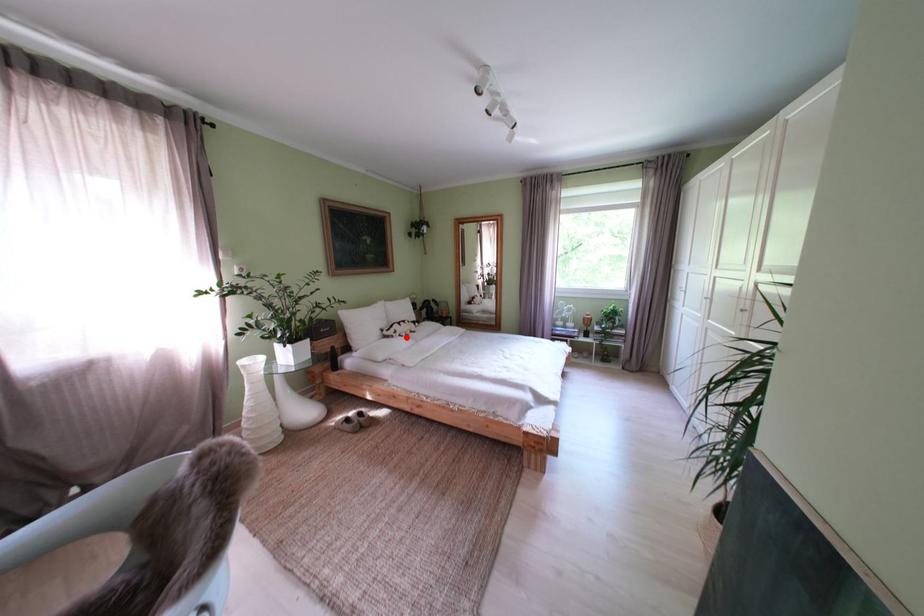
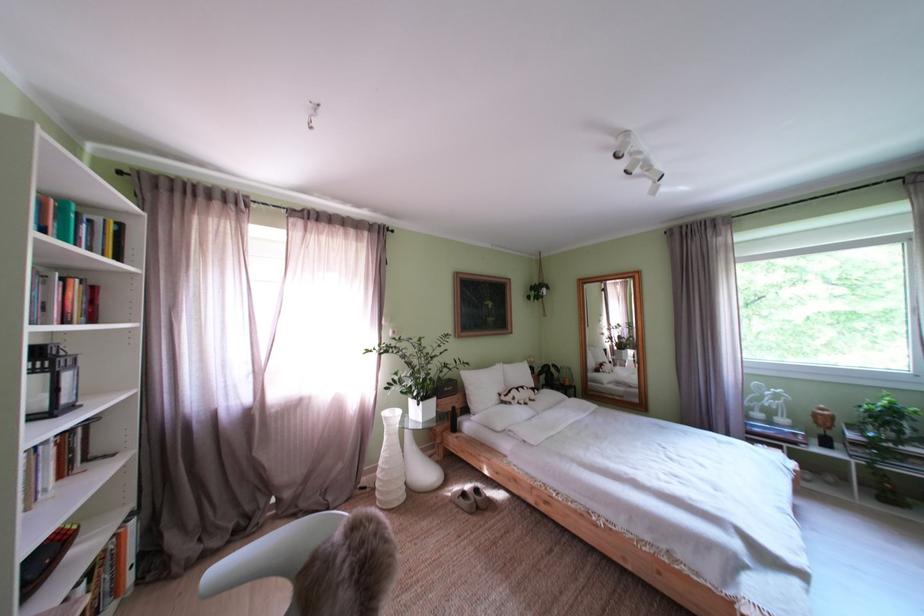
Question: I am providing you with two images of the same scene from different viewpoints. Given a red point in image1, look at the same physical point in image2. Is it:

Choices:
 (A) Closer to the viewpoint
 (B) Farther from the viewpoint

Answer: (B)